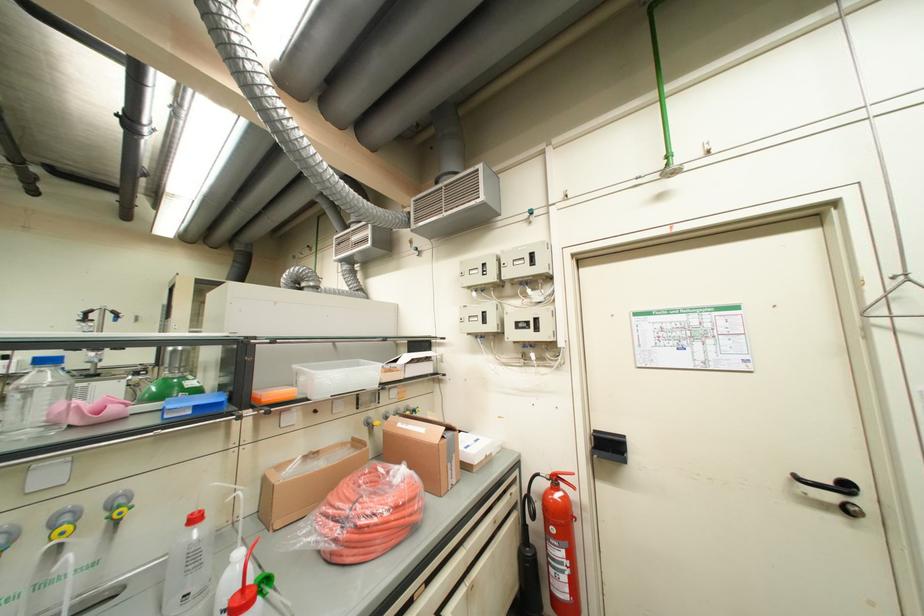
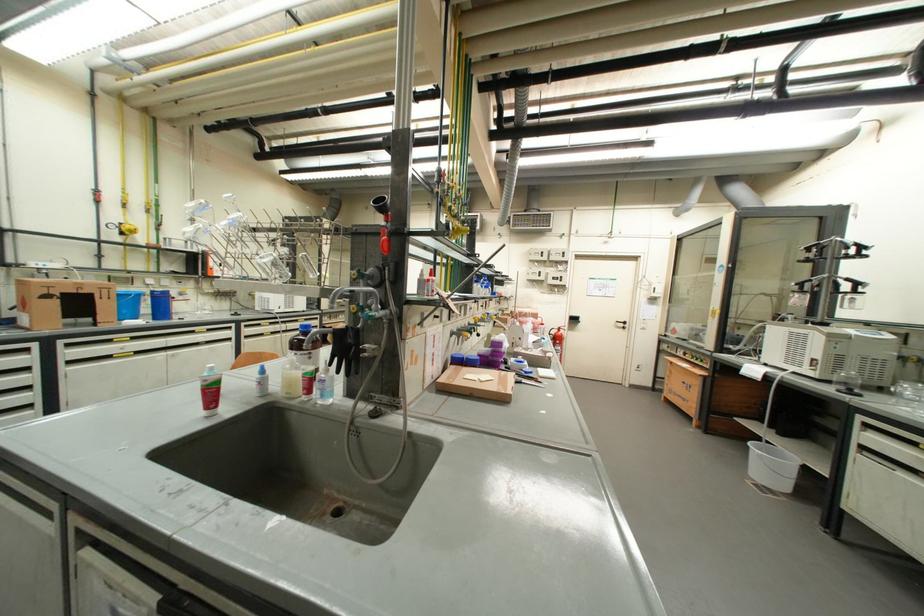
In a continuous first-person perspective shot, in which direction is the camera moving?

The cameraman walked toward left, backward.